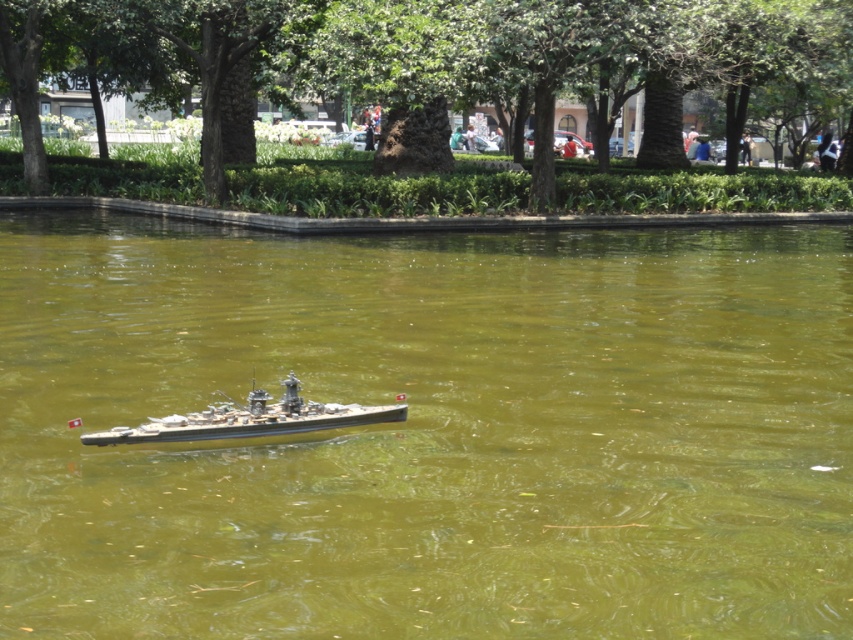
Question: Can you confirm if green murky water at center is positioned to the left of metallic gray ship at center?

Choices:
 (A) no
 (B) yes

Answer: (A)

Question: Is green murky water at center thinner than metallic gray ship at center?

Choices:
 (A) no
 (B) yes

Answer: (A)

Question: In this image, where is green murky water at center located relative to metallic gray ship at center?

Choices:
 (A) right
 (B) left

Answer: (A)

Question: Which of the following is the closest to the observer?

Choices:
 (A) green murky water at center
 (B) metallic gray ship at center

Answer: (A)

Question: Which point is closer to the camera?

Choices:
 (A) (267, 417)
 (B) (608, 275)

Answer: (A)